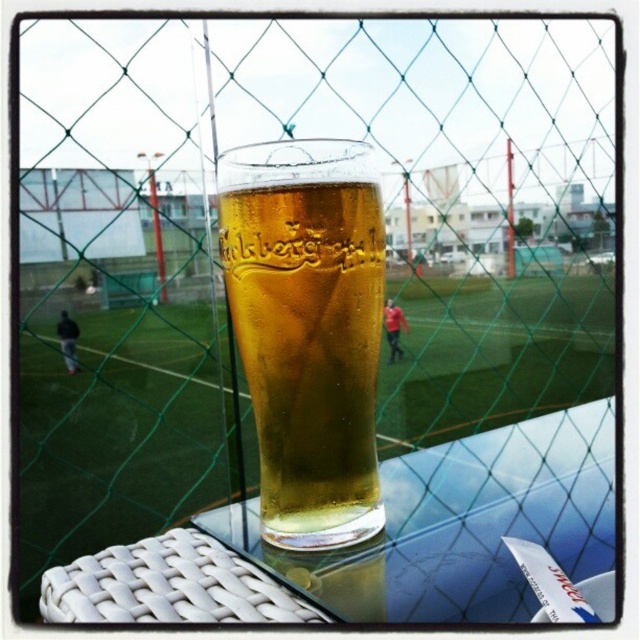
Question: Which point appears farthest from the camera in this image?

Choices:
 (A) (432, 481)
 (B) (296, 358)

Answer: (A)

Question: Does transparent glass table at center appear over translucent glass beer at center?

Choices:
 (A) yes
 (B) no

Answer: (B)

Question: Can you confirm if transparent glass table at center is positioned to the right of translucent glass beer at center?

Choices:
 (A) yes
 (B) no

Answer: (A)

Question: Which point is farther from the camera taking this photo?

Choices:
 (A) click(x=326, y=474)
 (B) click(x=410, y=605)

Answer: (A)

Question: In this image, where is transparent glass table at center located relative to translucent glass beer at center?

Choices:
 (A) above
 (B) below

Answer: (B)

Question: Which object appears closest to the camera in this image?

Choices:
 (A) transparent glass table at center
 (B) translucent glass beer at center

Answer: (A)